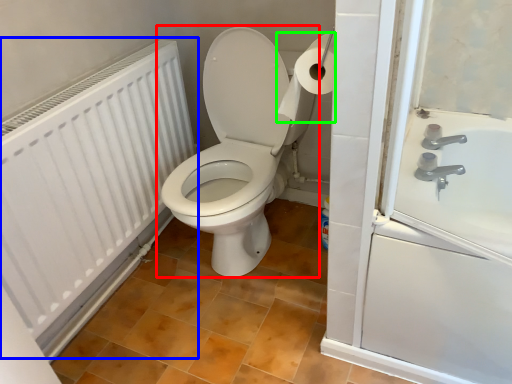
Question: Which is farther away from toilet (highlighted by a red box)? radiator (highlighted by a blue box) or toilet paper (highlighted by a green box)?

Choices:
 (A) radiator
 (B) toilet paper

Answer: (B)